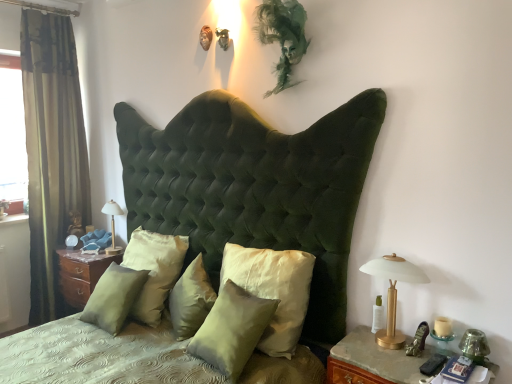
Identify the location of vacant space situated above green velvet curtain at left (from a real-world perspective). The height and width of the screenshot is (384, 512). (46, 9).